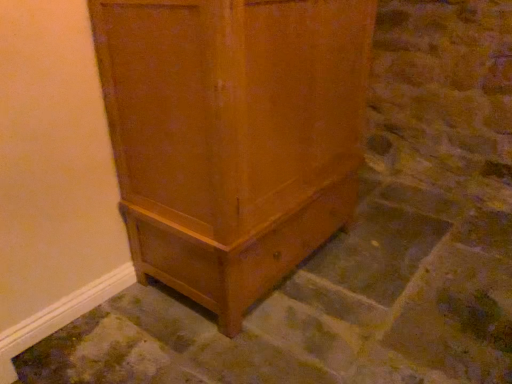
At what (x,y) coordinates should I click in order to perform the action: click on vacant space to the right of matte wood cabinet at center. Please return your answer as a coordinate pair (x, y). Looking at the image, I should click on (396, 259).